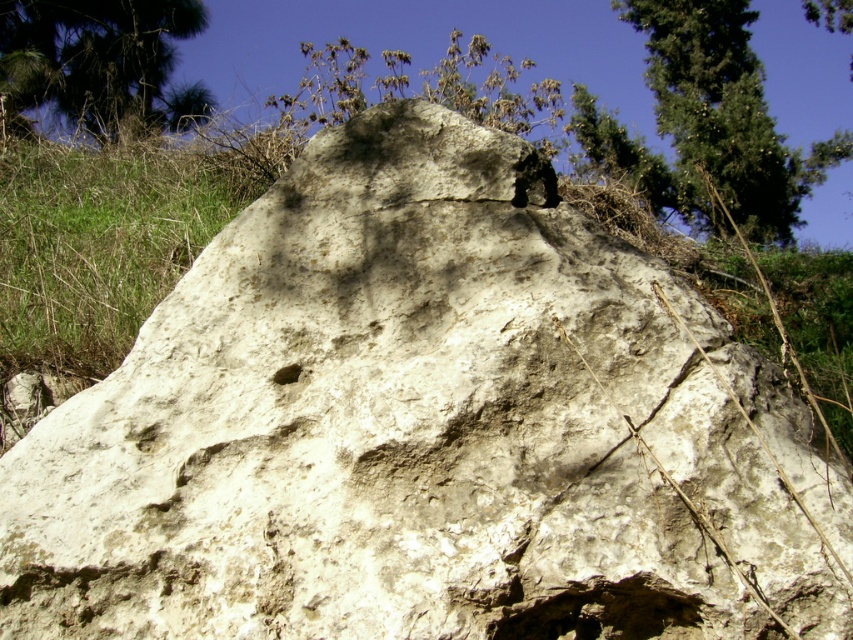
You are standing at the base of the large rock formation in the image. You see a point marked at coordinates (723,116). Which object does this point indicate?

The point at coordinates (723,116) corresponds to the green leafy tree at upper right.

You are standing in front of the rock formation and looking towards the background. You see two green leafy trees in the distance. Which tree is closer to you, the green leafy tree at upper right or the green leafy tree at upper left?

The green leafy tree at upper left is closer to you because it is positioned below the green leafy tree at upper right, which is further away.